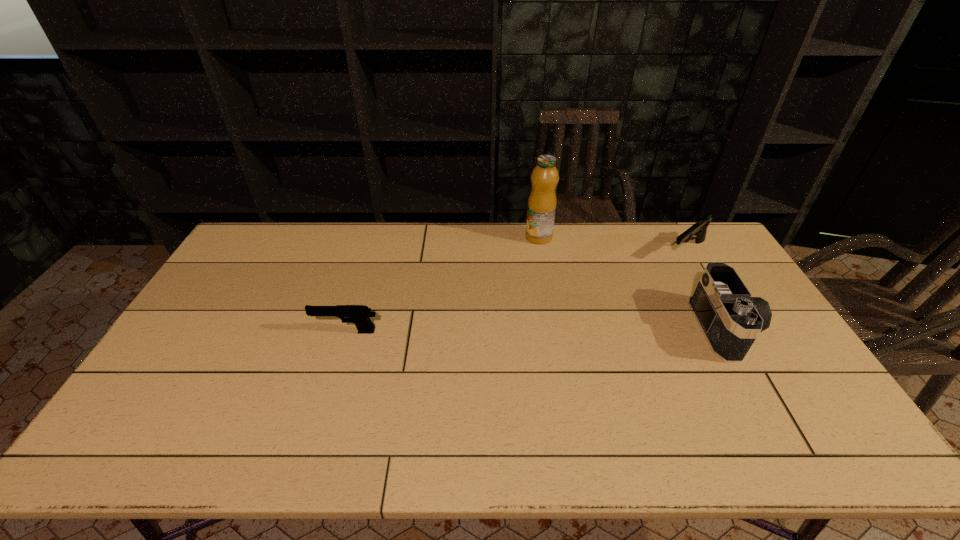
Where is `pistol`? pistol is located at coordinates (358, 314).

This screenshot has width=960, height=540. I want to click on the second tallest object, so click(730, 319).

At what (x,y) coordinates should I click in order to perform the action: click on gun. Please return your answer as a coordinate pair (x, y). Looking at the image, I should click on (699, 229).

Identify the location of the second object from left to right. (542, 201).

The image size is (960, 540). I want to click on the tallest object, so click(x=542, y=201).

At what (x,y) coordinates should I click in order to perform the action: click on vacant space located on the front-facing side of the pistol. Please return your answer as a coordinate pair (x, y). This screenshot has height=540, width=960. Looking at the image, I should click on (259, 332).

In order to click on vacant space situated on the front-facing side of the pistol in this screenshot , I will do `click(242, 332)`.

This screenshot has height=540, width=960. What are the coordinates of `vacant space located on the front-facing side of the pistol` in the screenshot? It's located at (187, 332).

Where is `vacant space situated 0.070m on the front-facing side of the camera`? vacant space situated 0.070m on the front-facing side of the camera is located at coordinates (778, 328).

At what (x,y) coordinates should I click in order to perform the action: click on blank space located at the aiming end of the gun. Please return your answer as a coordinate pair (x, y). The image size is (960, 540). Looking at the image, I should click on (646, 282).